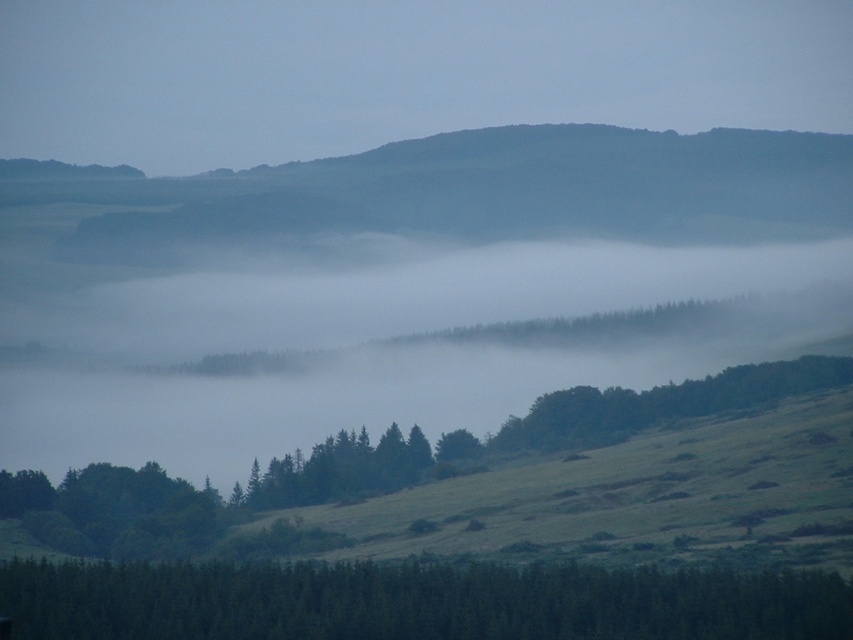
Is green matte tree at lower center thinner than green matte tree at lower left?

No, green matte tree at lower center is not thinner than green matte tree at lower left.

Image resolution: width=853 pixels, height=640 pixels. I want to click on green matte tree at lower center, so click(x=416, y=602).